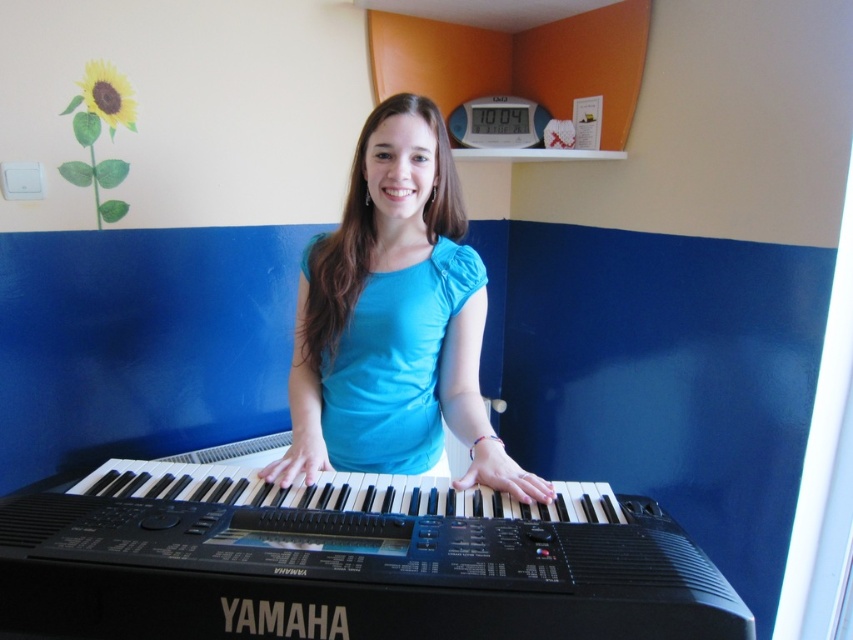
Question: Is black plastic piano at center smaller than blue fabric shirt at center?

Choices:
 (A) no
 (B) yes

Answer: (B)

Question: Which object appears farthest from the camera in this image?

Choices:
 (A) blue fabric shirt at center
 (B) black plastic piano at center

Answer: (A)

Question: Can you confirm if black plastic piano at center is wider than blue fabric shirt at center?

Choices:
 (A) yes
 (B) no

Answer: (A)

Question: Among these objects, which one is nearest to the camera?

Choices:
 (A) blue fabric shirt at center
 (B) black plastic piano at center

Answer: (B)

Question: Is black plastic piano at center positioned at the back of blue fabric shirt at center?

Choices:
 (A) no
 (B) yes

Answer: (A)